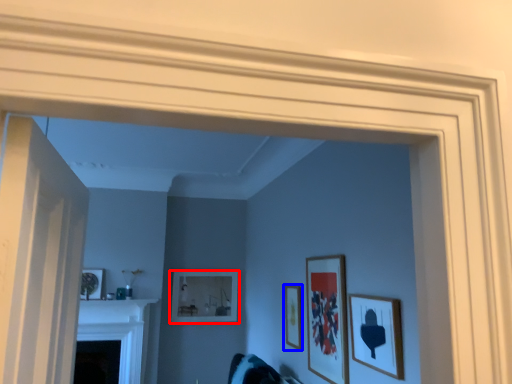
Question: Which of the following is the closest to the observer, picture frame (highlighted by a red box) or picture frame (highlighted by a blue box)?

Choices:
 (A) picture frame
 (B) picture frame

Answer: (B)